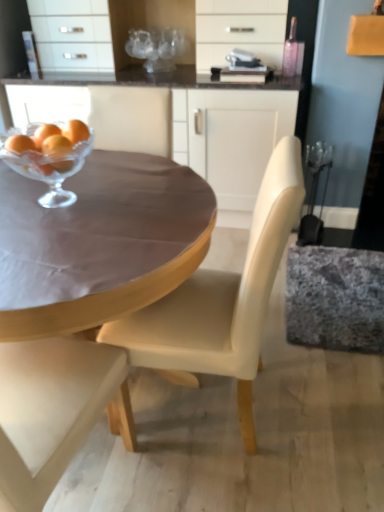
Question: Considering the relative positions of matte white cabinet at upper center and clear glass bowl at center in the image provided, is matte white cabinet at upper center to the left or to the right of clear glass bowl at center?

Choices:
 (A) left
 (B) right

Answer: (B)

Question: From a real-world perspective, is matte white cabinet at upper center positioned above or below clear glass bowl at center?

Choices:
 (A) below
 (B) above

Answer: (A)

Question: Which object is the farthest from the granite-like fabric swivel chair at right?

Choices:
 (A) translucent glass tangerine at upper left
 (B) matte cream chair at center
 (C) matte white cabinet at upper center
 (D) matte brown table at center
 (E) clear glass bowl at center

Answer: (A)

Question: Which object is the closest to the matte white cabinet at upper center?

Choices:
 (A) clear glass bowl at center
 (B) matte cream chair at center
 (C) granite-like fabric swivel chair at right
 (D) translucent glass tangerine at upper left
 (E) matte brown table at center

Answer: (C)